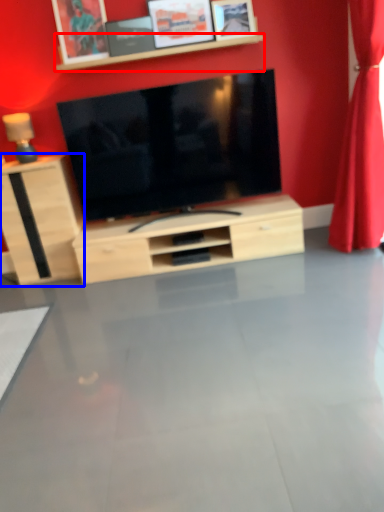
Question: Which object appears farthest to the camera in this image, shelf (highlighted by a red box) or cabinetry (highlighted by a blue box)?

Choices:
 (A) shelf
 (B) cabinetry

Answer: (B)